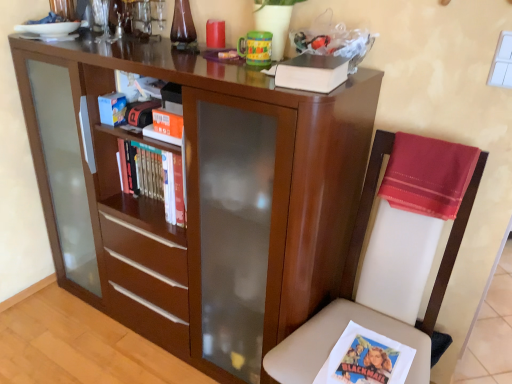
Question: From the image's perspective, is matte wood bookcase at center beneath silky red cloth at right?

Choices:
 (A) no
 (B) yes

Answer: (B)

Question: Is matte wood bookcase at center shorter than silky red cloth at right?

Choices:
 (A) yes
 (B) no

Answer: (B)

Question: Can you confirm if matte wood bookcase at center is taller than silky red cloth at right?

Choices:
 (A) yes
 (B) no

Answer: (A)

Question: Is matte wood bookcase at center to the right of silky red cloth at right from the viewer's perspective?

Choices:
 (A) yes
 (B) no

Answer: (B)

Question: Considering the relative sizes of matte wood bookcase at center and silky red cloth at right in the image provided, is matte wood bookcase at center thinner than silky red cloth at right?

Choices:
 (A) no
 (B) yes

Answer: (A)

Question: Is matte wood bookcase at center far away from silky red cloth at right?

Choices:
 (A) yes
 (B) no

Answer: (B)

Question: Would you say hardcover books at center is a long distance from silky red cloth at right?

Choices:
 (A) no
 (B) yes

Answer: (A)

Question: Does hardcover books at center have a greater height compared to silky red cloth at right?

Choices:
 (A) yes
 (B) no

Answer: (B)

Question: Can you confirm if hardcover books at center is smaller than silky red cloth at right?

Choices:
 (A) no
 (B) yes

Answer: (B)

Question: From a real-world perspective, is hardcover books at center beneath silky red cloth at right?

Choices:
 (A) yes
 (B) no

Answer: (A)

Question: From the image's perspective, is hardcover books at center on top of silky red cloth at right?

Choices:
 (A) yes
 (B) no

Answer: (A)

Question: Can you confirm if hardcover books at center is thinner than silky red cloth at right?

Choices:
 (A) yes
 (B) no

Answer: (B)

Question: Considering the relative sizes of white leather chair at right and matte wood bookcase at center in the image provided, is white leather chair at right thinner than matte wood bookcase at center?

Choices:
 (A) no
 (B) yes

Answer: (A)